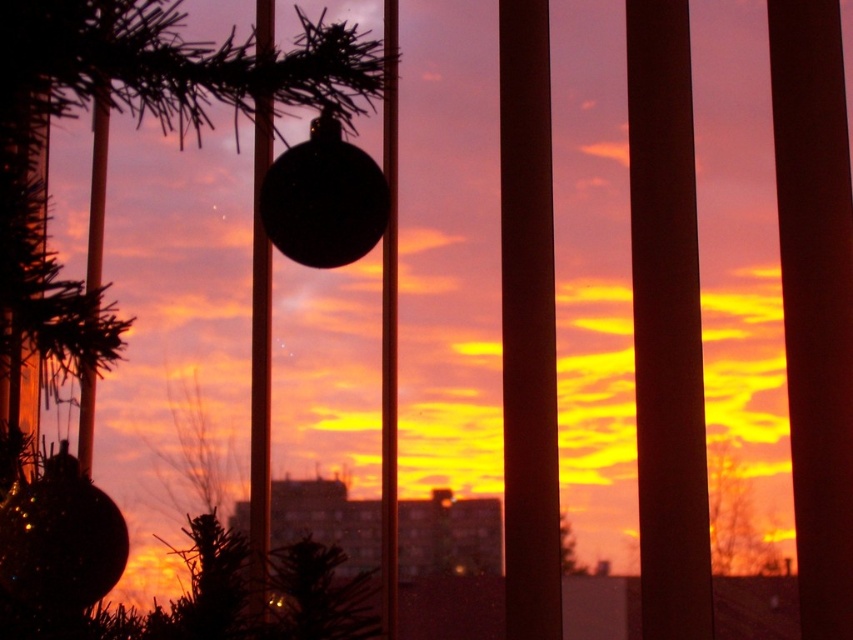
You are standing in a room with a Christmas tree and want to reach the shiny metallic ornament at upper center. If your maximum reach is 36 inches, can you touch it without moving closer?

The shiny metallic ornament at upper center is 36.80 inches away from you, which is beyond your 36 inches reach. Therefore, you cannot touch it without moving closer.

You are a drone operator trying to capture a photo of the shiny metallic ornament at upper center and the green matte tree at center. The camera has a maximum focus range of 30 inches. Can you capture both objects in focus without moving the drone?

The distance between the shiny metallic ornament at upper center and the green matte tree at center is 30.13 inches, which exceeds the camera maximum focus range of 30 inches. Therefore, you cannot capture both objects in focus without moving the drone.